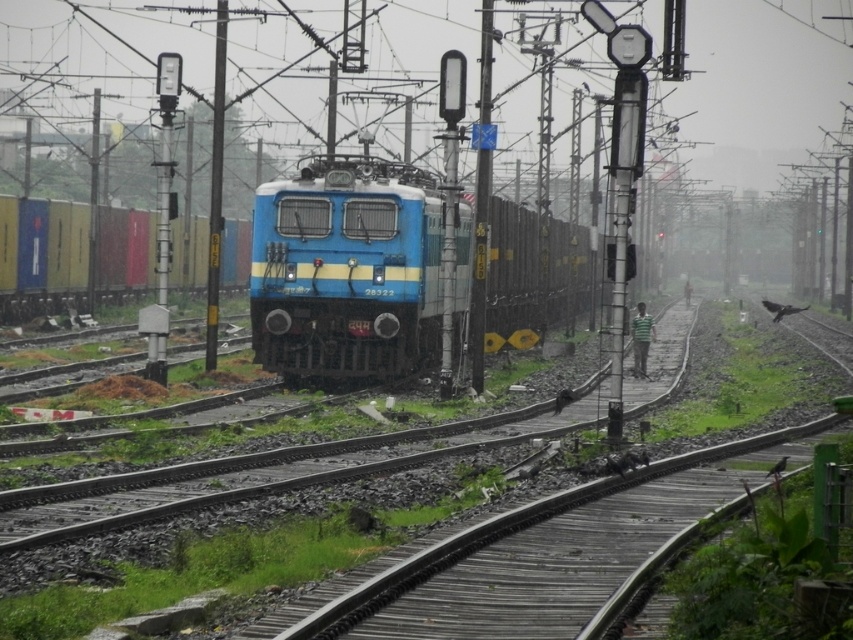
Does blue glossy locomotive at center appear on the left side of wooden at center?

Correct, you'll find blue glossy locomotive at center to the left of wooden at center.

Between blue glossy locomotive at center and wooden at center, which one appears on the right side from the viewer's perspective?

From the viewer's perspective, wooden at center appears more on the right side.

Who is more forward, (x=524, y=216) or (x=360, y=582)?

Point (x=360, y=582)

At what (x,y) coordinates should I click in order to perform the action: click on blue glossy locomotive at center. Please return your answer as a coordinate pair (x, y). Looking at the image, I should click on [x=347, y=272].

Is blue matte train at center shorter than wooden at center?

In fact, blue matte train at center may be taller than wooden at center.

Is blue matte train at center bigger than wooden at center?

Correct, blue matte train at center is larger in size than wooden at center.

Between point (30, 259) and point (833, 420), which one is positioned in front?

Point (833, 420) is in front.

This screenshot has height=640, width=853. Identify the location of blue matte train at center. (39, 257).

Between blue glossy locomotive at center and blue matte train at center, which one has more height?

blue glossy locomotive at center

Locate an element on the screen. This screenshot has height=640, width=853. blue glossy locomotive at center is located at coordinates (347, 272).